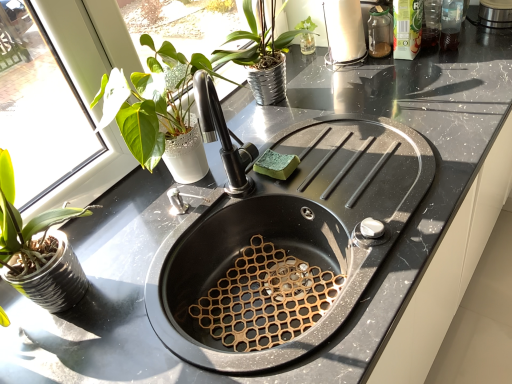
The image size is (512, 384). Describe the element at coordinates (276, 165) in the screenshot. I see `green sponge at sink` at that location.

What is the approximate width of white glossy paper towel holder at upper right?

5.48 inches.

The width and height of the screenshot is (512, 384). What are the coordinates of `black matte sink at center` in the screenshot? It's located at (288, 227).

The width and height of the screenshot is (512, 384). What do you see at coordinates (288, 227) in the screenshot?
I see `black matte sink at center` at bounding box center [288, 227].

At what (x,y) coordinates should I click in order to perform the action: click on green sponge at sink. Please return your answer as a coordinate pair (x, y). Looking at the image, I should click on (276, 165).

What's the angular difference between green sponge at sink and black matte sink at center's facing directions?

green sponge at sink and black matte sink at center are facing 1.78 degrees away from each other.

Is green sponge at sink in contact with black matte sink at center?

green sponge at sink and black matte sink at center are clearly separated.

Can you confirm if green sponge at sink is positioned to the right of black matte sink at center?

Incorrect, green sponge at sink is not on the right side of black matte sink at center.

From the image's perspective, is green sponge at sink positioned above or below black matte sink at center?

Clearly, from the image's perspective, green sponge at sink is above black matte sink at center.

Considering the points (365, 46) and (283, 160), which point is in front, point (365, 46) or point (283, 160)?

The point (283, 160) is closer.

Is the surface of white glossy paper towel holder at upper right in direct contact with green sponge at sink?

No, white glossy paper towel holder at upper right is not with green sponge at sink.

Is white glossy paper towel holder at upper right looking in the opposite direction of green sponge at sink?

That's not correct — white glossy paper towel holder at upper right is not looking away from green sponge at sink.

Can you confirm if white glossy paper towel holder at upper right is shorter than green sponge at sink?

In fact, white glossy paper towel holder at upper right may be taller than green sponge at sink.

Considering the positions of objects green sponge at sink and white glossy paper towel holder at upper right in the image provided, who is in front, green sponge at sink or white glossy paper towel holder at upper right?

Positioned in front is green sponge at sink.

Consider the image. From a real-world perspective, which object stands above the other?

From a 3D spatial view, white glossy paper towel holder at upper right is above.

Is green sponge at sink smaller than white glossy paper towel holder at upper right?

Correct, green sponge at sink occupies less space than white glossy paper towel holder at upper right.

Find the location of a particular element. food located on the left of white glossy paper towel holder at upper right is located at coordinates (276, 165).

Does black matte sink at center have a lesser width compared to white glossy paper towel holder at upper right?

Incorrect, the width of black matte sink at center is not less than that of white glossy paper towel holder at upper right.

Looking at this image, does black matte sink at center come in front of white glossy paper towel holder at upper right?

Yes, black matte sink at center is closer to the camera.

Is black matte sink at center inside or outside of white glossy paper towel holder at upper right?

black matte sink at center is located beyond the bounds of white glossy paper towel holder at upper right.

Which is further, (238, 184) or (360, 50)?

The point (360, 50) is more distant.

Which is less distant, (x=322, y=205) or (x=273, y=152)?

Point (x=322, y=205) is positioned closer to the camera compared to point (x=273, y=152).

Between black matte sink at center and green sponge at sink, which one has smaller size?

With smaller size is green sponge at sink.

Is black matte sink at center oriented towards green sponge at sink?

No, black matte sink at center is not oriented towards green sponge at sink.

Is black matte sink at center far away from green sponge at sink?

No, black matte sink at center is not far away from green sponge at sink.

Can you tell me how much white glossy paper towel holder at upper right and black matte sink at center differ in facing direction?

The facing directions of white glossy paper towel holder at upper right and black matte sink at center are 2.58 degrees apart.

Considering the sizes of white glossy paper towel holder at upper right and black matte sink at center in the image, is white glossy paper towel holder at upper right bigger or smaller than black matte sink at center?

white glossy paper towel holder at upper right is smaller than black matte sink at center.

In terms of height, does white glossy paper towel holder at upper right look taller or shorter compared to black matte sink at center?

white glossy paper towel holder at upper right is taller than black matte sink at center.

Is white glossy paper towel holder at upper right placed right next to black matte sink at center?

No, white glossy paper towel holder at upper right is not next to black matte sink at center.

Identify the location of food on the left of black matte sink at center. (276, 165).

Locate an element on the screen. The width and height of the screenshot is (512, 384). food directly beneath the white glossy paper towel holder at upper right (from a real-world perspective) is located at coordinates (276, 165).

Which object lies further to the anchor point white glossy paper towel holder at upper right, green sponge at sink or black matte sink at center?

Among the two, black matte sink at center is located further to white glossy paper towel holder at upper right.

Considering their positions, is green sponge at sink positioned closer to black matte sink at center than white glossy paper towel holder at upper right?

The object closer to black matte sink at center is green sponge at sink.

Looking at the image, which one is located further to green sponge at sink, black matte sink at center or white glossy paper towel holder at upper right?

white glossy paper towel holder at upper right.

Considering their positions, is white glossy paper towel holder at upper right positioned further to green sponge at sink than black matte sink at center?

Among the two, white glossy paper towel holder at upper right is located further to green sponge at sink.

When comparing their distances from black matte sink at center, does white glossy paper towel holder at upper right or green sponge at sink seem further?

white glossy paper towel holder at upper right is positioned further to the anchor black matte sink at center.

Which object lies further to the anchor point white glossy paper towel holder at upper right, black matte sink at center or green sponge at sink?

Among the two, black matte sink at center is located further to white glossy paper towel holder at upper right.

Find the location of a particular element. food between white glossy paper towel holder at upper right and black matte sink at center vertically is located at coordinates (276, 165).